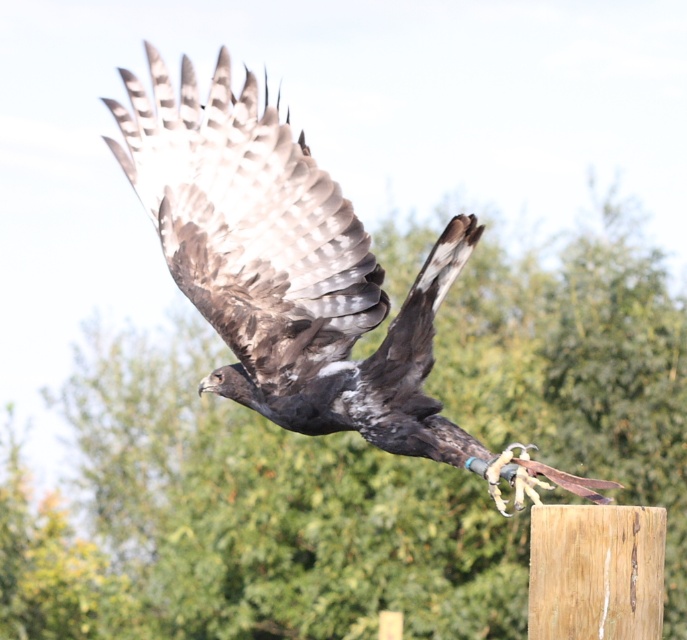
What do you see at coordinates (295, 275) in the screenshot? I see `dark brown feathers at center` at bounding box center [295, 275].

Based on the photo, which of these two, dark brown feathers at center or wooden post at center, stands taller?

dark brown feathers at center

Consider the image. Who is more forward, [212,230] or [653,552]?

Point [653,552]

Where is `dark brown feathers at center`? The width and height of the screenshot is (687, 640). dark brown feathers at center is located at coordinates (295, 275).

Which is above, gray feathered wing at center or wooden post at center?

gray feathered wing at center is above.

Based on the photo, can you confirm if gray feathered wing at center is smaller than wooden post at center?

Incorrect, gray feathered wing at center is not smaller in size than wooden post at center.

Does point (139, 136) come behind point (541, 556)?

Yes, it is.

Identify the location of gray feathered wing at center. This screenshot has width=687, height=640. tap(249, 225).

At what (x,y) coordinates should I click in order to perform the action: click on green leafy tree at upper center. Please return your answer as a coordinate pair (x, y). This screenshot has width=687, height=640. Looking at the image, I should click on (240, 520).

I want to click on green leafy tree at upper center, so click(x=240, y=520).